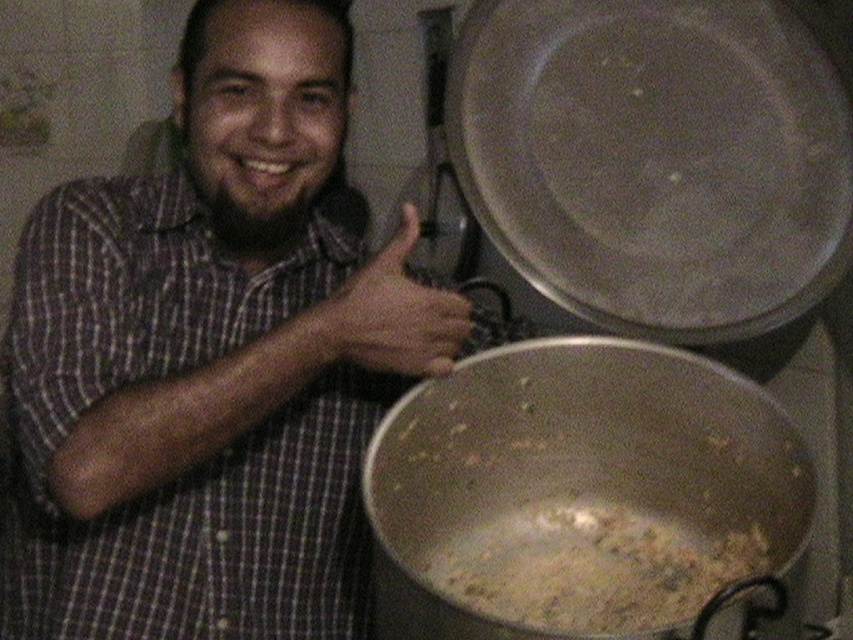
You are a chef who needs to serve the brown crumbly food at center to a customer. The customer wants to know if the metallic silver pot at lower center can hold the food. Can you confirm?

The metallic silver pot at lower center has a larger size compared to brown crumbly food at center, so yes, the pot can hold the food.

You are a chef who needs to reach the brown crumbly food at center without touching the matte plaid shirt at center. The minimum distance you need to maintain between your hand and the shirt is 10 inches. Can you safely do this?

The matte plaid shirt at center and brown crumbly food at center are 12.09 inches apart. Since the required minimum distance is 10 inches, you can safely reach the brown crumbly food at center without touching the matte plaid shirt at center as the distance is sufficient.